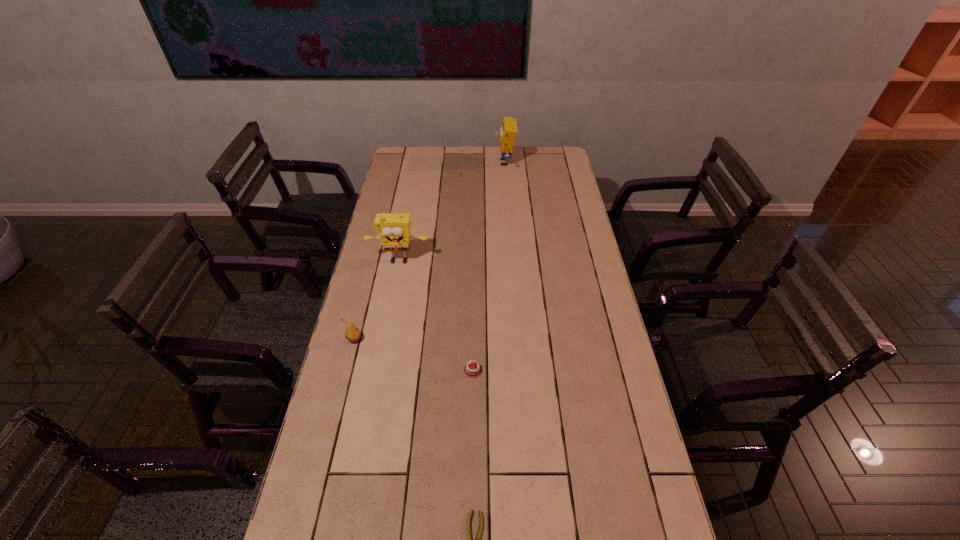
Where is `free space that satisfies the following two spatial constraints: 1. on the front-facing side of the chocolate cake; 2. on the right side of the left sponge`? free space that satisfies the following two spatial constraints: 1. on the front-facing side of the chocolate cake; 2. on the right side of the left sponge is located at coordinates (378, 370).

Where is `vacant space that satisfies the following two spatial constraints: 1. on the front side of the third nearest object; 2. on the left side of the chocolate cake`? vacant space that satisfies the following two spatial constraints: 1. on the front side of the third nearest object; 2. on the left side of the chocolate cake is located at coordinates (347, 370).